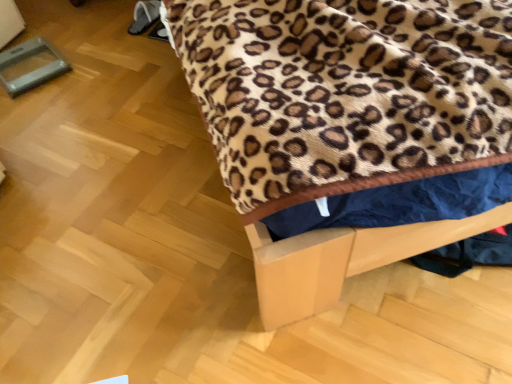
Image resolution: width=512 pixels, height=384 pixels. Describe the element at coordinates (345, 123) in the screenshot. I see `leopard print fabric at upper center` at that location.

Consider the image. What is the approximate width of leopard print fabric at upper center?

The width of leopard print fabric at upper center is 6.03 feet.

At what (x,y) coordinates should I click in order to perform the action: click on leopard print fabric at upper center. Please return your answer as a coordinate pair (x, y). Looking at the image, I should click on (345, 123).

Locate an element on the screen. The image size is (512, 384). leopard print fabric at upper center is located at coordinates (345, 123).